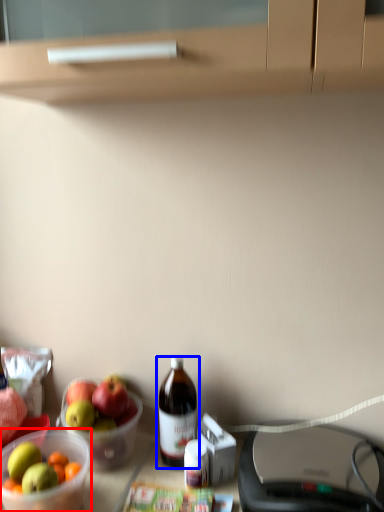
Question: Which object appears closest to the camera in this image, bowl (highlighted by a red box) or bottle (highlighted by a blue box)?

Choices:
 (A) bowl
 (B) bottle

Answer: (A)